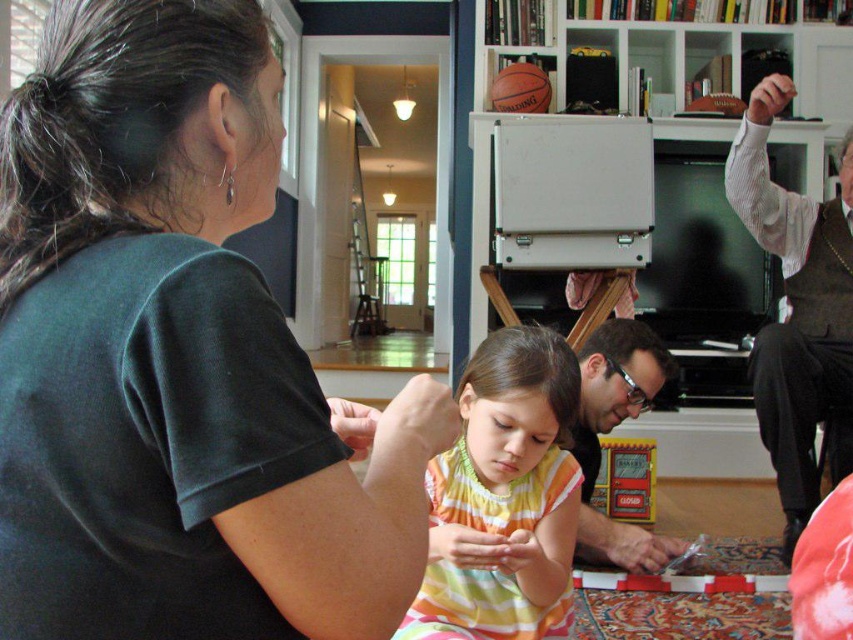
Question: Which object is closer to the camera taking this photo?

Choices:
 (A) yellow striped dress at center
 (B) matte black book at center
 (C) black matte shirt at upper left

Answer: (C)

Question: Which point is closer to the camera?

Choices:
 (A) striped shirt at right
 (B) matte black book at center
 (C) yellow striped dress at center

Answer: (C)

Question: Does black matte shirt at upper left lie behind yellow striped dress at center?

Choices:
 (A) yes
 (B) no

Answer: (B)

Question: Does black matte shirt at upper left appear on the right side of yellow striped dress at center?

Choices:
 (A) no
 (B) yes

Answer: (A)

Question: Which point is farther from the camera taking this photo?

Choices:
 (A) tap(766, 333)
 (B) tap(376, 554)
 (C) tap(606, 385)
 (D) tap(440, 461)

Answer: (A)

Question: Does black matte shirt at upper left have a greater width compared to striped shirt at right?

Choices:
 (A) no
 (B) yes

Answer: (A)